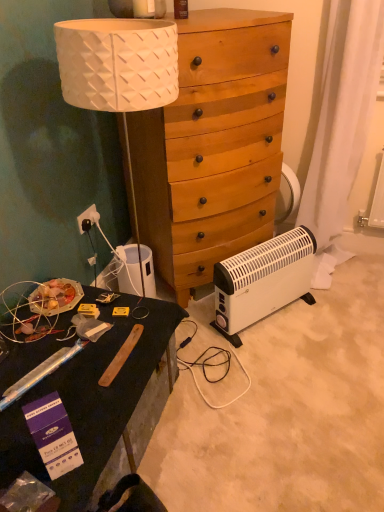
The width and height of the screenshot is (384, 512). In order to click on free space below white plastic radiator at lower right (from a real-world perspective) in this screenshot , I will do `click(274, 320)`.